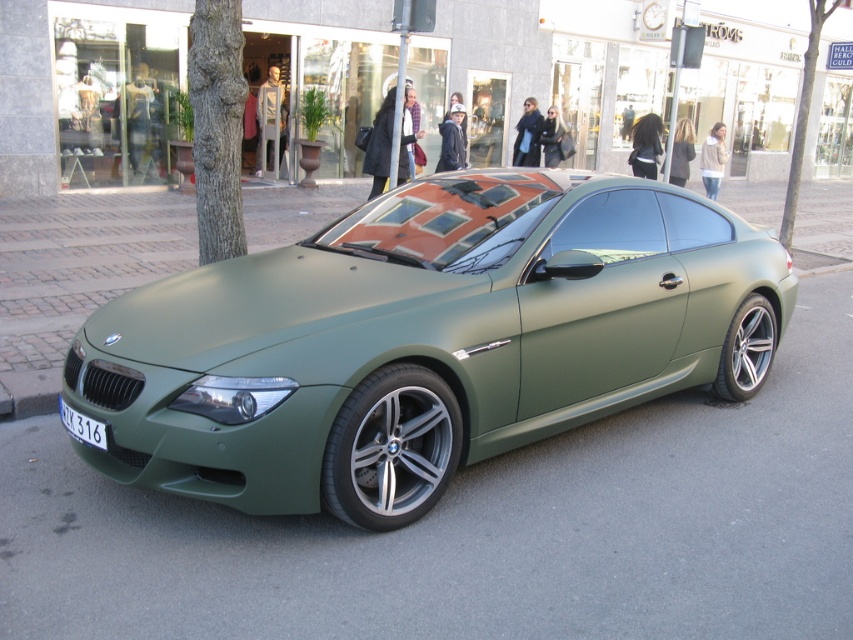
Question: Which point is closer to the camera?

Choices:
 (A) white plastic license plate at lower left
 (B) matte green car at center

Answer: (B)

Question: Is matte green car at center in front of white plastic license plate at lower left?

Choices:
 (A) no
 (B) yes

Answer: (B)

Question: Among these points, which one is nearest to the camera?

Choices:
 (A) (73, 428)
 (B) (599, 376)

Answer: (A)

Question: Is matte green car at center below white plastic license plate at lower left?

Choices:
 (A) no
 (B) yes

Answer: (A)

Question: Can you confirm if matte green car at center is positioned to the right of white plastic license plate at lower left?

Choices:
 (A) no
 (B) yes

Answer: (B)